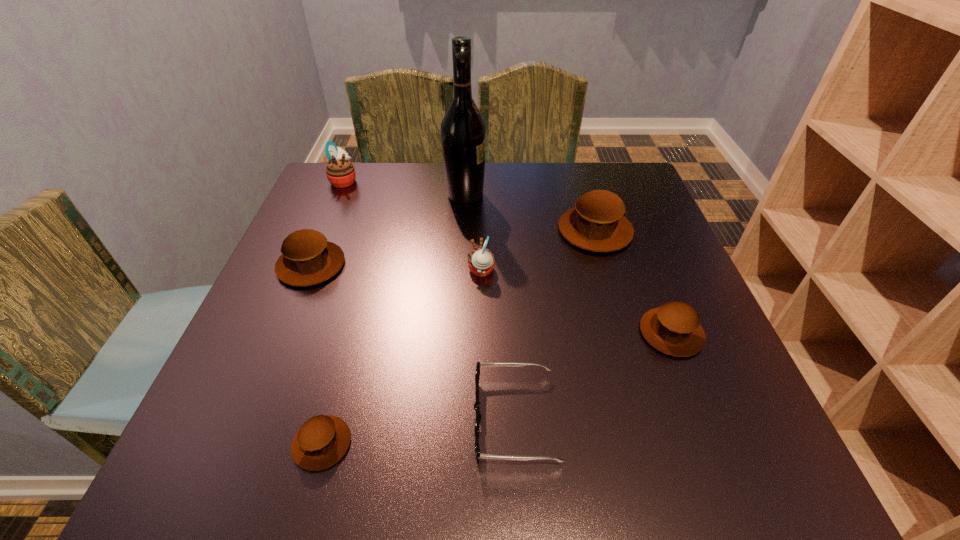
Identify the location of empty space between the second smallest brown muffin and the second biggest brown muffin. (492, 299).

What are the coordinates of `blank region between the biggest brown muffin and the farther pink muffin` in the screenshot? It's located at (469, 206).

This screenshot has height=540, width=960. In order to click on free space between the spectacles and the leftmost brown muffin in this screenshot , I will do `click(413, 341)`.

Where is `vacant space that is in between the nearest muffin and the left pink muffin`? vacant space that is in between the nearest muffin and the left pink muffin is located at coordinates (333, 312).

Image resolution: width=960 pixels, height=540 pixels. I want to click on empty space that is in between the leftmost brown muffin and the tallest object, so click(388, 230).

I want to click on object identified as the closest to the left pink muffin, so click(307, 258).

Point out which object is positioned as the nearest to the tallest object. Please provide its 2D coordinates. Your answer should be formatted as a tuple, i.e. [(x, y)], where the tuple contains the x and y coordinates of a point satisfying the conditions above.

[(596, 223)]

This screenshot has height=540, width=960. I want to click on muffin that is the third closest to the nearest muffin, so click(x=674, y=328).

Identify which muffin is located as the third nearest to the second nearest muffin. Please provide its 2D coordinates. Your answer should be formatted as a tuple, i.e. [(x, y)], where the tuple contains the x and y coordinates of a point satisfying the conditions above.

[(323, 440)]

Where is `brown muffin that stands as the closest to the fifth farthest muffin`? This screenshot has height=540, width=960. brown muffin that stands as the closest to the fifth farthest muffin is located at coordinates (596, 223).